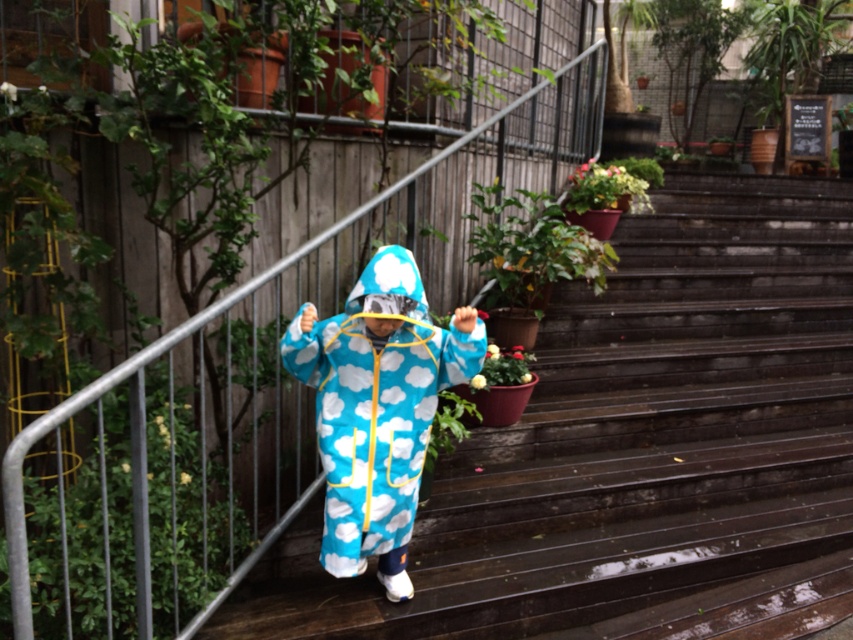
You are the child in the image holding the yellow object. You want to place your toy on the nearest green leafy plant. Which one should you choose between the green leafy plant at lower left and the green leafy plant at center?

The green leafy plant at lower left is to the left of green leafy plant at center, so the nearest one would depend on your position. Since you are walking up the stairs holding the toy, the green leafy plant at lower left is closer to you and should be the one to choose.

You are a delivery robot with a package that is 1.2 meters wide. You need to move through the wooden stairs at center while avoiding the green matte flower pot at upper center. Can your package fit through the space between the stairs and the flower pot?

The wooden stairs at center are wider than the green matte flower pot at upper center. Since the package is 1.2 meters wide, it depends on the actual width measurements. However, since the stairs are wider, there might be enough space for the package to pass through if the combined width of the stairs and flower pot allows it. Without exact measurements, we cannot be certain, but the description suggests the stairs are wider, so there is a possibility.